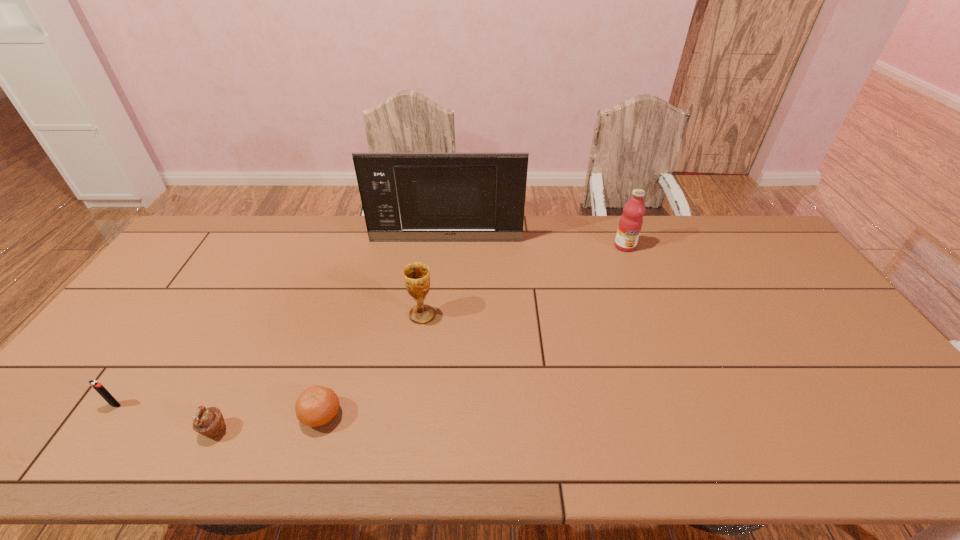
Find the location of a particular element. microwave oven is located at coordinates (405, 196).

Where is `fruit juice`? The width and height of the screenshot is (960, 540). fruit juice is located at coordinates (631, 221).

You are a GUI agent. You are given a task and a screenshot of the screen. Output one action in this format:
    pyautogui.click(x=<x>, y=<y>)
    Task: Click on the rightmost object
    
    Given the screenshot: What is the action you would take?
    pyautogui.click(x=631, y=221)

Where is `chalice`? chalice is located at coordinates (416, 275).

Locate an element on the screen. This screenshot has width=960, height=540. the third farthest object is located at coordinates (416, 275).

At what (x,y) coordinates should I click in order to perform the action: click on the leftmost object. Please return your answer as a coordinate pair (x, y). Image resolution: width=960 pixels, height=540 pixels. Looking at the image, I should click on (95, 384).

Where is `muffin`? muffin is located at coordinates (209, 422).

The height and width of the screenshot is (540, 960). Find the location of `clementine`. clementine is located at coordinates click(x=316, y=406).

Image resolution: width=960 pixels, height=540 pixels. Find the location of `free space located 0.290m on the front panel of the microwave oven`. free space located 0.290m on the front panel of the microwave oven is located at coordinates (441, 300).

This screenshot has width=960, height=540. Find the location of `blank area located 0.210m on the label of the fruit juice`. blank area located 0.210m on the label of the fruit juice is located at coordinates (644, 296).